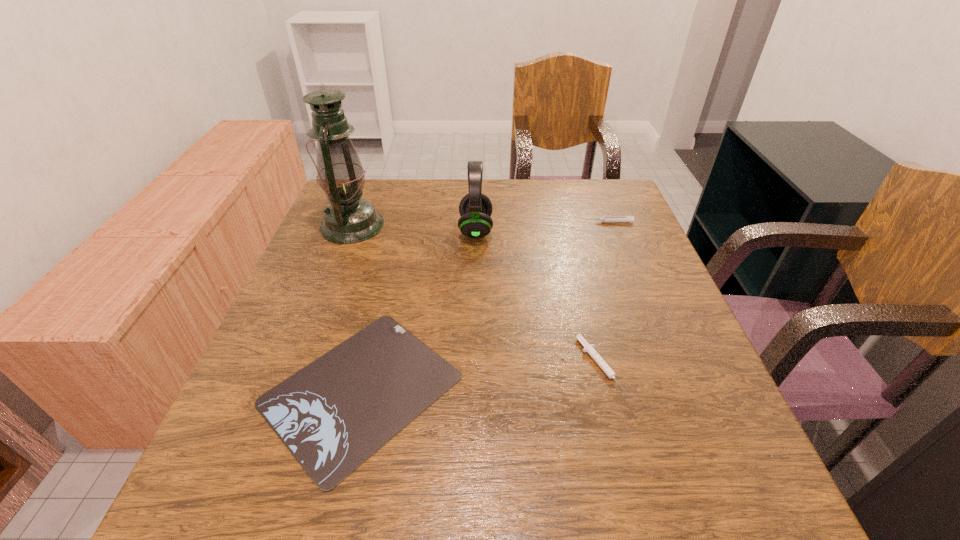
Where is `vacant space situated at the needle end of the right syringe`? This screenshot has height=540, width=960. vacant space situated at the needle end of the right syringe is located at coordinates (502, 222).

Where is `free space located at the needle end of the right syringe`? This screenshot has width=960, height=540. free space located at the needle end of the right syringe is located at coordinates (484, 222).

This screenshot has height=540, width=960. Find the location of `free space located 0.170m on the front of the nearer syringe`. free space located 0.170m on the front of the nearer syringe is located at coordinates (631, 493).

In order to click on free space located on the back of the shortest object in this screenshot , I will do `click(391, 266)`.

The image size is (960, 540). I want to click on oil lamp that is at the far edge, so click(348, 219).

I want to click on headset located in the far edge section of the desktop, so click(x=475, y=208).

Find the location of a particular element. syringe located at the far edge is located at coordinates (630, 219).

Where is `object that is at the near edge`? The height and width of the screenshot is (540, 960). object that is at the near edge is located at coordinates (333, 414).

Where is `oil lamp present at the left edge`? This screenshot has width=960, height=540. oil lamp present at the left edge is located at coordinates (348, 219).

At what (x,y) coordinates should I click in order to perform the action: click on mousepad located at the left edge. Please return your answer as a coordinate pair (x, y). Looking at the image, I should click on (333, 414).